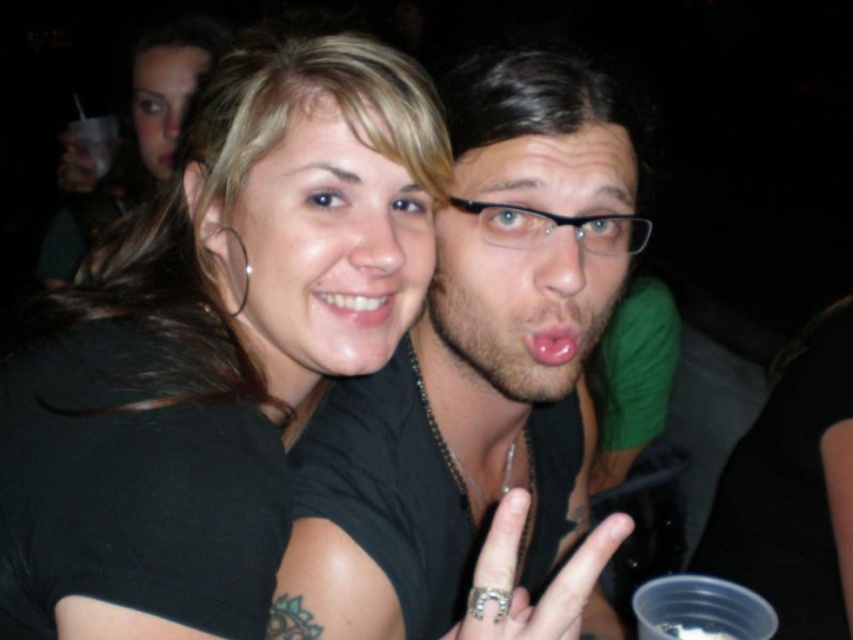
Based on the scene description, can you determine the location of the point with coordinates (x=328, y=252) in relation to the people depicted?

The point at coordinates (x=328, y=252) is located on the matte black hair at center, which belongs to the man with dark hair and glasses in the foreground.

You are a photographer at the party and want to take a closeup shot of both the matte black hair at center and the matte black face at center. Which object should you zoom in on more to ensure both fit in the frame?

The matte black hair at center is smaller than the matte black face at center, so you should zoom in more on the matte black face at center to ensure both fit in the frame.

You are a photographer at the party and want to capture both the matte black hair at center and the smooth skin face at upper left in a single frame. Which of the two objects should you focus on first to ensure both are in focus?

The matte black hair at center is smaller than the smooth skin face at upper left, so you should focus on the smooth skin face at upper left first to ensure both are in focus.